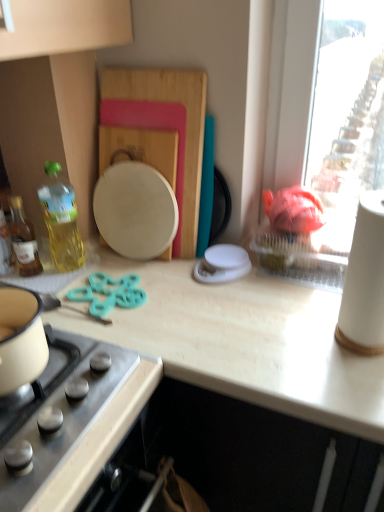
Locate an element on the screen. vacant space in front of white paper towel at right is located at coordinates (352, 389).